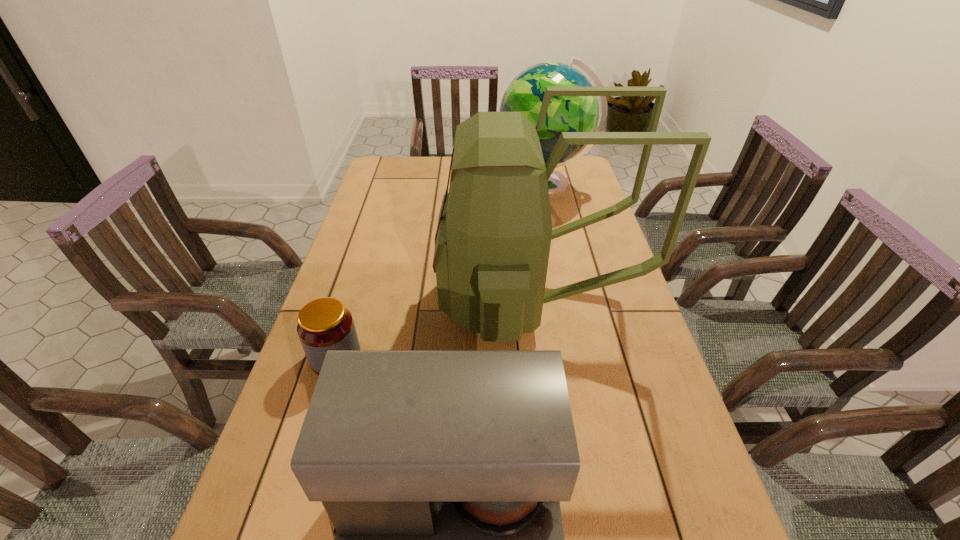
Locate an element on the screen. This screenshot has height=540, width=960. free space located 0.270m on the back of the leftmost object is located at coordinates (364, 269).

Identify the location of object present at the far edge. The height and width of the screenshot is (540, 960). (525, 94).

The width and height of the screenshot is (960, 540). I want to click on object present at the left edge, so click(324, 324).

Where is `backpack at the right edge`? This screenshot has width=960, height=540. backpack at the right edge is located at coordinates (492, 243).

Where is `globe present at the right edge`? globe present at the right edge is located at coordinates (525, 94).

I want to click on object that is at the far right corner, so click(525, 94).

Where is `free point at the far edge`? free point at the far edge is located at coordinates (438, 185).

Locate an element on the screen. vacant space at the left edge of the desktop is located at coordinates (347, 239).

In the image, there is a desktop. Identify the location of vacant space at the right edge. (589, 349).

Where is `vacant area at the far left corner`? vacant area at the far left corner is located at coordinates (382, 157).